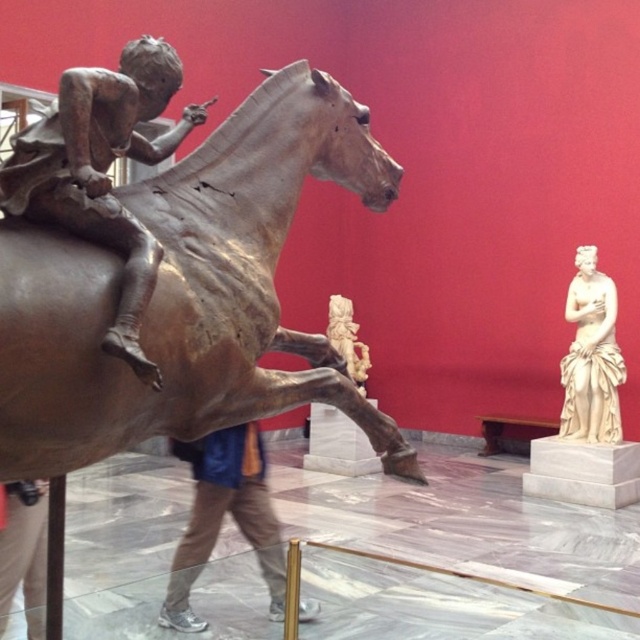
Question: Which is nearer to the bronze metallic horse at center?

Choices:
 (A) bronze statue at left
 (B) golden polished statue at center

Answer: (A)

Question: Can you confirm if blue denim jeans at center is positioned to the left of golden polished statue at center?

Choices:
 (A) yes
 (B) no

Answer: (A)

Question: Considering the real-world distances, which object is farthest from the golden polished statue at center?

Choices:
 (A) blue denim jeans at center
 (B) bronze statue at left

Answer: (B)

Question: Can you confirm if bronze metallic horse at center is wider than bronze statue at left?

Choices:
 (A) yes
 (B) no

Answer: (A)

Question: Which point is closer to the camera?

Choices:
 (A) bronze statue at left
 (B) white marble statue at right

Answer: (A)

Question: Does bronze metallic horse at center have a greater width compared to blue denim jeans at center?

Choices:
 (A) no
 (B) yes

Answer: (B)